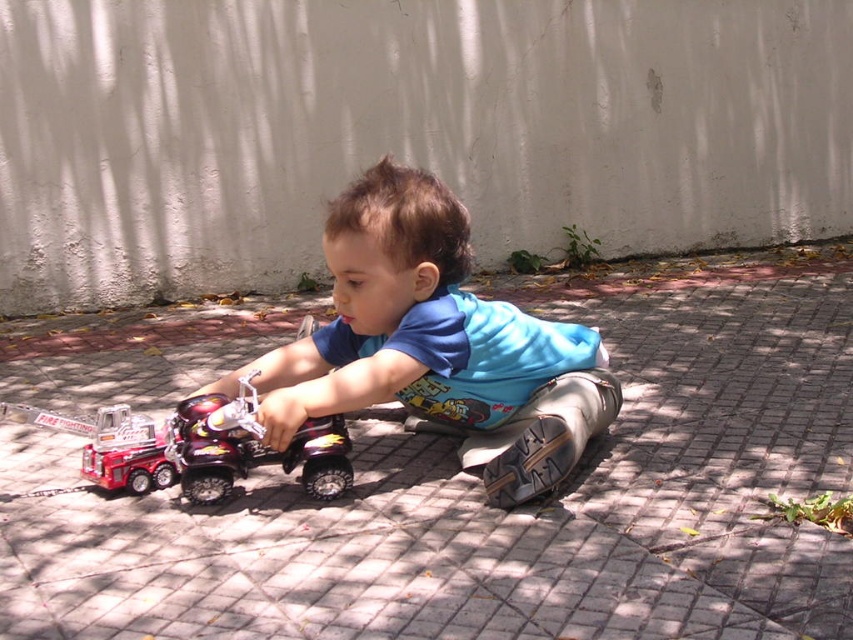
You are standing at the position of the child and want to place a small toy car between the two points, point (x=180, y=435) and point (x=119, y=476). Which point should the toy car be closer to if you want it to be closer to the child?

The toy car should be closer to point (x=119, y=476) because it is behind point (x=180, y=435) from the child perspective.

You are a parent observing your child playing with the metallic red fire truck at left and the metallic red fire truck at lower left. Which fire truck is closer to the child?

The metallic red fire truck at lower left is closer to the child because it is positioned lower, which typically indicates proximity in such scenes.